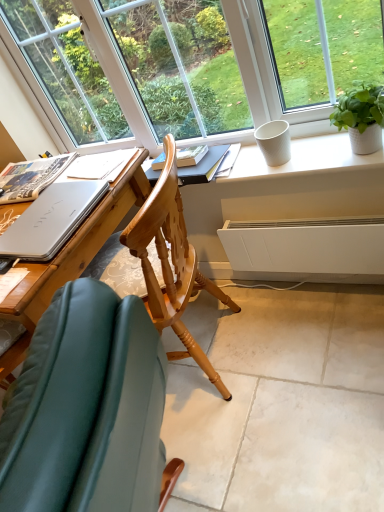
Locate an element on the screen. Image resolution: width=384 pixels, height=512 pixels. white paper at left is located at coordinates (31, 177).

Locate an element on the screen. The height and width of the screenshot is (512, 384). white ceramic pot at upper right is located at coordinates (361, 117).

What do you see at coordinates (361, 117) in the screenshot?
I see `white ceramic pot at upper right` at bounding box center [361, 117].

This screenshot has width=384, height=512. Identify the location of sleek silver laptop at left. (x=51, y=220).

This screenshot has height=512, width=384. I want to click on white paper at left, so click(31, 177).

Is white paper at left inside or outside of sleek silver laptop at left?

white paper at left is outside sleek silver laptop at left.

Does point (55, 159) come behind point (19, 216)?

That is True.

From a real-world perspective, is white paper at left on top of sleek silver laptop at left?

No, from a real-world perspective, white paper at left is not above sleek silver laptop at left.

Which object is positioned more to the left, white paper at left or sleek silver laptop at left?

From the viewer's perspective, white paper at left appears more on the left side.

Which object is positioned more to the left, wooden chair at center or white ceramic pot at upper right?

Positioned to the left is wooden chair at center.

Does wooden chair at center lie behind white ceramic pot at upper right?

No, wooden chair at center is closer to the camera.

The image size is (384, 512). In order to click on chair beneath the white ceramic pot at upper right (from a real-world perspective) in this screenshot , I will do `click(86, 408)`.

Does wooden chair at center turn towards white ceramic pot at upper right?

No, wooden chair at center is not oriented towards white ceramic pot at upper right.

Looking at this image, which object is thinner, white ceramic pot at upper right or white paper at left?

white ceramic pot at upper right.

Find the location of `houseplant in front of the white paper at left`. houseplant in front of the white paper at left is located at coordinates (361, 117).

Is white ceramic pot at upper right turned away from white paper at left?

No, white ceramic pot at upper right is not facing away from white paper at left.

From the image's perspective, is white ceramic pot at upper right located above or below white paper at left?

From the image's perspective, white ceramic pot at upper right appears above white paper at left.

From the image's perspective, does white paper at left appear lower than wooden chair at center?

No.

Looking at this image, from a real-world perspective, who is located lower, white paper at left or wooden chair at center?

wooden chair at center is physically lower.

Does point (9, 198) come behind point (82, 401)?

Yes, point (9, 198) is farther from viewer.

Which is more to the right, white paper at left or wooden chair at center?

Positioned to the right is wooden chair at center.

Is wooden chair at center closer to camera compared to white paper at left?

Yes, it is in front of white paper at left.

From the image's perspective, does wooden chair at center appear higher than white paper at left?

Answer: No, from the image's perspective, wooden chair at center is not above white paper at left.

In the scene shown: Is wooden chair at center placed right next to white paper at left?

No, wooden chair at center is not with white paper at left.

Is wooden chair at center outside of white paper at left?

wooden chair at center lies outside white paper at left's area.

How different are the orientations of white ceramic pot at upper right and wooden chair at center in degrees?

They differ by 69.2 degrees in their facing directions.

From a real-world perspective, is white ceramic pot at upper right on top of wooden chair at center?

Yes, from a real-world perspective, white ceramic pot at upper right is on top of wooden chair at center.

The width and height of the screenshot is (384, 512). I want to click on houseplant that appears above the wooden chair at center (from the image's perspective), so click(361, 117).

Based on the photo, is the position of white ceramic pot at upper right more distant than that of wooden chair at center?

Yes.

Does sleek silver laptop at left have a greater width compared to wooden chair at center?

No, sleek silver laptop at left is not wider than wooden chair at center.

Does point (52, 198) lie behind point (58, 307)?

Yes, it is.

From the image's perspective, which object appears higher, sleek silver laptop at left or wooden chair at center?

sleek silver laptop at left appears higher in the image.

Could you tell me if sleek silver laptop at left is turned towards wooden chair at center?

Yes, sleek silver laptop at left is facing wooden chair at center.

The height and width of the screenshot is (512, 384). I want to click on laptop above the white paper at left (from a real-world perspective), so click(x=51, y=220).

This screenshot has width=384, height=512. I want to click on chair below the white ceramic pot at upper right (from the image's perspective), so click(86, 408).

From the image, which object appears to be nearer to white ceramic pot at upper right, white paper at left or sleek silver laptop at left?

The object closer to white ceramic pot at upper right is sleek silver laptop at left.

Based on their spatial positions, is sleek silver laptop at left or wooden chair at center closer to white paper at left?

sleek silver laptop at left.

Consider the image. Looking at the image, which one is located further to wooden chair at center, white ceramic pot at upper right or sleek silver laptop at left?

white ceramic pot at upper right is further to wooden chair at center.

Considering their positions, is sleek silver laptop at left positioned closer to white ceramic pot at upper right than wooden chair at center?

Based on the image, sleek silver laptop at left appears to be nearer to white ceramic pot at upper right.

When comparing their distances from wooden chair at center, does white paper at left or sleek silver laptop at left seem further?

white paper at left is further to wooden chair at center.

When comparing their distances from sleek silver laptop at left, does white ceramic pot at upper right or white paper at left seem closer?

The object closer to sleek silver laptop at left is white paper at left.

Based on their spatial positions, is white paper at left or white ceramic pot at upper right closer to wooden chair at center?

white paper at left lies closer to wooden chair at center than the other object.

Consider the image. Estimate the real-world distances between objects in this image. Which object is further from sleek silver laptop at left, white paper at left or wooden chair at center?

Based on the image, wooden chair at center appears to be further to sleek silver laptop at left.

Where is `laptop situated between white paper at left and white ceramic pot at upper right from left to right`? laptop situated between white paper at left and white ceramic pot at upper right from left to right is located at coordinates (51, 220).

Image resolution: width=384 pixels, height=512 pixels. What are the coordinates of `laptop positioned between wooden chair at center and white paper at left from near to far` in the screenshot? It's located at (51, 220).

Locate an element on the screen. This screenshot has width=384, height=512. chair situated between white paper at left and white ceramic pot at upper right from left to right is located at coordinates (86, 408).

Find the location of `chair located between sleek silver laptop at left and white ceramic pot at upper right in the left-right direction`. chair located between sleek silver laptop at left and white ceramic pot at upper right in the left-right direction is located at coordinates (86, 408).